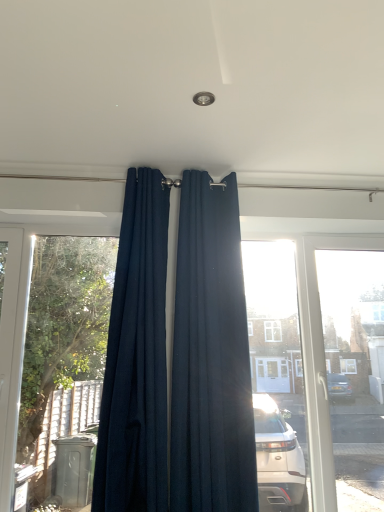
Question: Which direction should I rotate to look at navy blue fabric curtain at center, the 1th curtain positioned from the right?

Choices:
 (A) left
 (B) right

Answer: (B)

Question: From a real-world perspective, is navy blue fabric curtain at center, the 1th curtain positioned from the right, physically below navy blue fabric curtain at center, which appears as the first curtain when viewed from the left?

Choices:
 (A) yes
 (B) no

Answer: (A)

Question: From a real-world perspective, is navy blue fabric curtain at center, the second curtain positioned from the left, on top of navy blue fabric curtain at center, which appears as the first curtain when viewed from the left?

Choices:
 (A) yes
 (B) no

Answer: (B)

Question: Is navy blue fabric curtain at center, the second curtain positioned from the left, smaller than navy blue fabric curtain at center, which appears as the first curtain when viewed from the left?

Choices:
 (A) no
 (B) yes

Answer: (A)

Question: Is the surface of navy blue fabric curtain at center, the second curtain positioned from the left, in direct contact with navy blue fabric curtain at center, which appears as the first curtain when viewed from the left?

Choices:
 (A) yes
 (B) no

Answer: (B)

Question: Can you confirm if navy blue fabric curtain at center, the second curtain positioned from the left, is positioned to the left of navy blue fabric curtain at center, which appears as the first curtain when viewed from the left?

Choices:
 (A) yes
 (B) no

Answer: (B)

Question: From the image's perspective, is navy blue fabric curtain at center, the second curtain positioned from the left, located beneath navy blue fabric curtain at center, the 2th curtain when ordered from right to left?

Choices:
 (A) no
 (B) yes

Answer: (B)

Question: Considering the relative sizes of navy blue fabric curtain at center, the 2th curtain when ordered from right to left, and navy blue fabric curtain at center, the 1th curtain positioned from the right, in the image provided, is navy blue fabric curtain at center, the 2th curtain when ordered from right to left, smaller than navy blue fabric curtain at center, the 1th curtain positioned from the right,?

Choices:
 (A) no
 (B) yes

Answer: (B)

Question: Considering the relative positions of navy blue fabric curtain at center, the 2th curtain when ordered from right to left, and navy blue fabric curtain at center, the 1th curtain positioned from the right, in the image provided, is navy blue fabric curtain at center, the 2th curtain when ordered from right to left, to the left of navy blue fabric curtain at center, the 1th curtain positioned from the right, from the viewer's perspective?

Choices:
 (A) no
 (B) yes

Answer: (B)

Question: Is navy blue fabric curtain at center, which appears as the first curtain when viewed from the left, oriented away from navy blue fabric curtain at center, the 1th curtain positioned from the right?

Choices:
 (A) no
 (B) yes

Answer: (A)

Question: From the image's perspective, is navy blue fabric curtain at center, which appears as the first curtain when viewed from the left, beneath navy blue fabric curtain at center, the second curtain positioned from the left?

Choices:
 (A) no
 (B) yes

Answer: (A)

Question: Is navy blue fabric curtain at center, the 2th curtain when ordered from right to left, located outside navy blue fabric curtain at center, the second curtain positioned from the left?

Choices:
 (A) yes
 (B) no

Answer: (A)

Question: Is the surface of navy blue fabric curtain at center, the 2th curtain when ordered from right to left, in direct contact with navy blue fabric curtain at center, the 1th curtain positioned from the right?

Choices:
 (A) no
 (B) yes

Answer: (A)

Question: Is navy blue fabric curtain at center, the 1th curtain positioned from the right, in front of or behind navy blue fabric curtain at center, the 2th curtain when ordered from right to left, in the image?

Choices:
 (A) front
 (B) behind

Answer: (B)